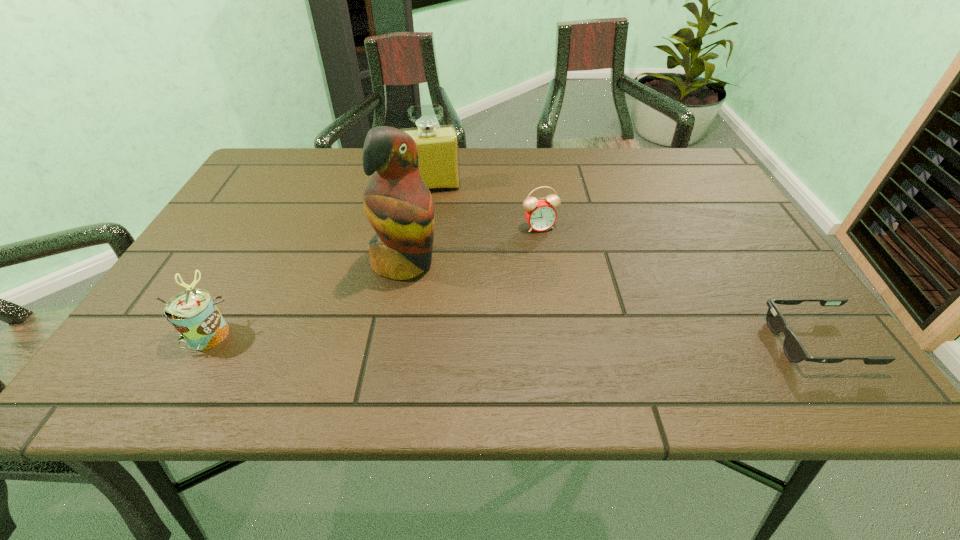
This screenshot has height=540, width=960. Identify the location of the third tallest object. (193, 313).

Image resolution: width=960 pixels, height=540 pixels. Find the location of `can`. can is located at coordinates (193, 313).

You are a GUI agent. You are given a task and a screenshot of the screen. Output one action in this format:
    pyautogui.click(x=<x>, y=<y>)
    Task: Click on the shortest object
    The image size is (960, 540).
    Given the screenshot: What is the action you would take?
    pyautogui.click(x=794, y=350)

At what (x,y) coordinates should I click in order to perform the action: click on the rightmost object. Please return your answer as a coordinate pair (x, y). Looking at the image, I should click on (x=794, y=350).

The width and height of the screenshot is (960, 540). In order to click on the farthest object in this screenshot , I will do `click(438, 146)`.

Where is `the fourth shortest object`? the fourth shortest object is located at coordinates (438, 146).

Find the location of a particular element. The height and width of the screenshot is (540, 960). the tallest object is located at coordinates (399, 206).

Image resolution: width=960 pixels, height=540 pixels. In order to click on the third farthest object in this screenshot , I will do `click(399, 206)`.

Where is `alarm clock`? The height and width of the screenshot is (540, 960). alarm clock is located at coordinates (540, 214).

Find the location of a particular element. The height and width of the screenshot is (540, 960). the fourth object from left to right is located at coordinates (540, 214).